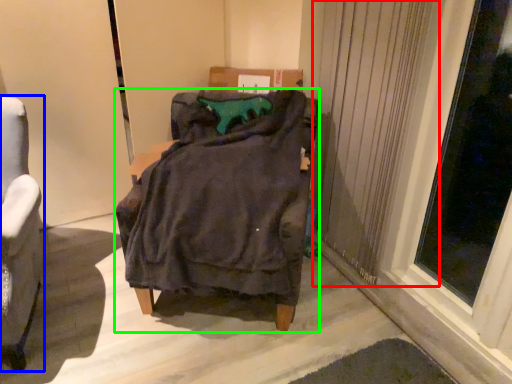
Question: Considering the real-world distances, which object is closest to curtain (highlighted by a red box)? chair (highlighted by a blue box) or furniture (highlighted by a green box).

Choices:
 (A) chair
 (B) furniture

Answer: (B)